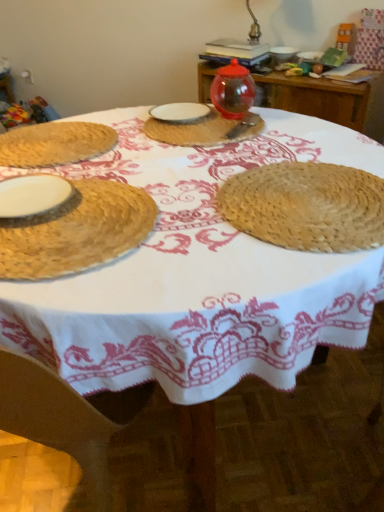
Where is `free space between natural straw placemat at center and transparent glass jar at upper center, the 4th tableware ordered from the bottom`? free space between natural straw placemat at center and transparent glass jar at upper center, the 4th tableware ordered from the bottom is located at coordinates pyautogui.click(x=260, y=150).